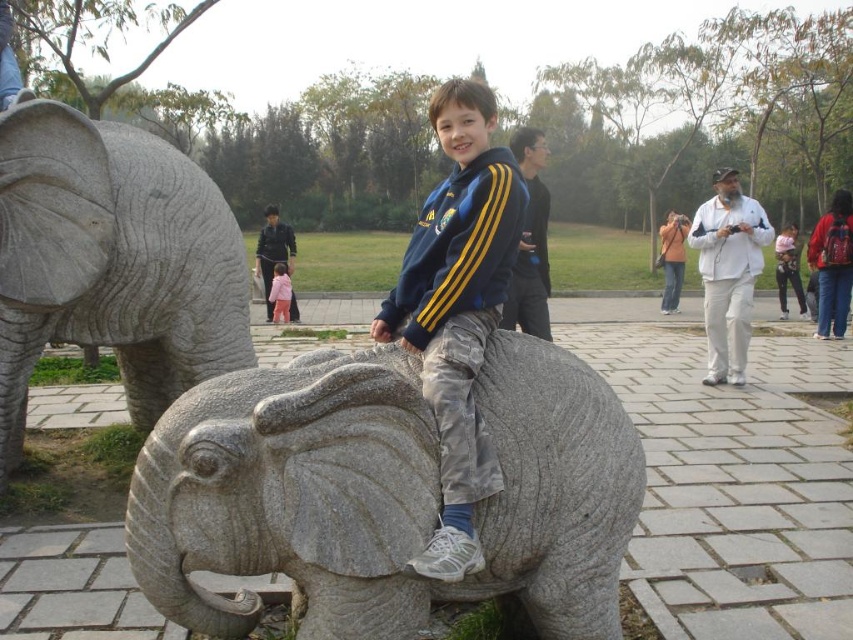
Question: Among these objects, which one is farthest from the camera?

Choices:
 (A) pink fabric child at center
 (B) gray stone elephant at center
 (C) gray stone elephant at left

Answer: (A)

Question: Considering the real-world distances, which object is farthest from the gray stone elephant at center?

Choices:
 (A) gray stone elephant at left
 (B) pink fabric child at center
 (C) matte gray elephant at center

Answer: (B)

Question: Does gray stone elephant at left appear under matte gray elephant at center?

Choices:
 (A) yes
 (B) no

Answer: (B)

Question: Which of the following is the farthest from the observer?

Choices:
 (A) tap(405, 602)
 (B) tap(281, 269)

Answer: (B)

Question: Is gray stone elephant at center bigger than matte gray elephant at center?

Choices:
 (A) no
 (B) yes

Answer: (B)

Question: Does matte gray elephant at center appear on the right side of pink fabric child at center?

Choices:
 (A) yes
 (B) no

Answer: (A)